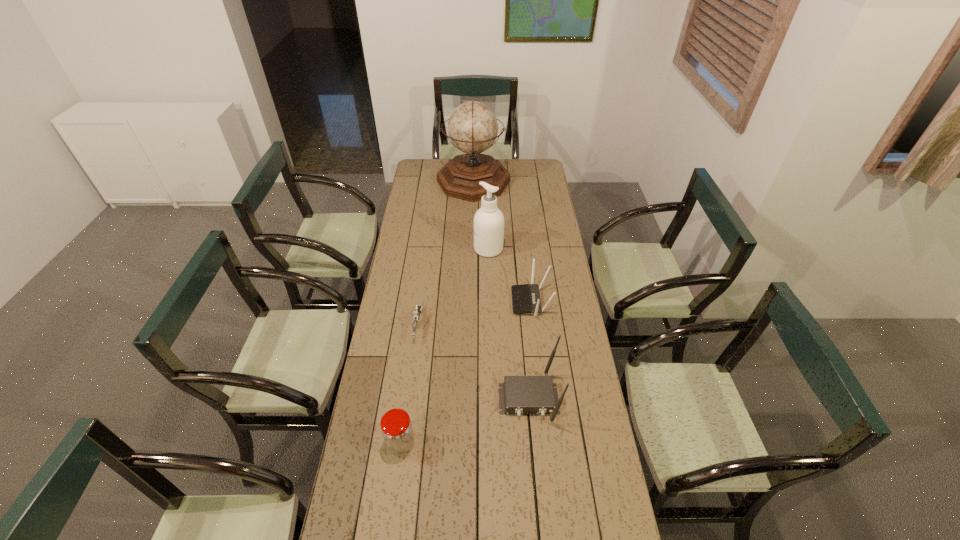
Locate an element on the screen. the farthest object is located at coordinates (472, 127).

Find the location of a particular element. the tallest object is located at coordinates (472, 127).

The image size is (960, 540). What are the coordinates of `the fifth shortest object` in the screenshot? It's located at (488, 221).

This screenshot has width=960, height=540. I want to click on the fifth nearest object, so click(x=488, y=221).

Find the location of a particular element. The height and width of the screenshot is (540, 960). the nearer router is located at coordinates (520, 394).

Identify the location of the fourth shortest object. (520, 394).

You are a GUI agent. You are given a task and a screenshot of the screen. Output one action in this format:
    pyautogui.click(x=<x>, y=<y>)
    Task: Click on the farther router
    This screenshot has height=540, width=960.
    Given the screenshot: What is the action you would take?
    tap(525, 298)

Find the location of a particular element. The image size is (960, 540). jar is located at coordinates (397, 431).

At what (x,y) coordinates should I click in order to perform the action: click on the shortest object. Please return your answer as a coordinate pair (x, y). Looking at the image, I should click on (416, 314).

Where is `vacant space located on the surface of the farthest object`? This screenshot has height=540, width=960. vacant space located on the surface of the farthest object is located at coordinates (530, 181).